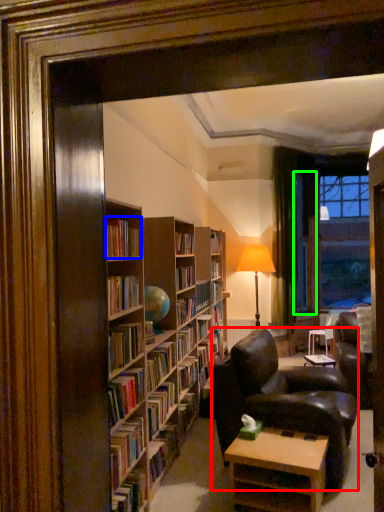
Question: Estimate the real-world distances between objects in this image. Which object is farther from chair (highlighted by a red box), book (highlighted by a blue box) or glass door (highlighted by a green box)?

Choices:
 (A) book
 (B) glass door

Answer: (B)